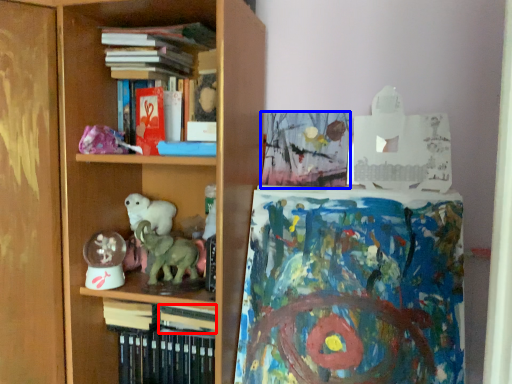
Question: Among these objects, which one is nearest to the camera, book (highlighted by a red box) or book (highlighted by a blue box)?

Choices:
 (A) book
 (B) book

Answer: (A)